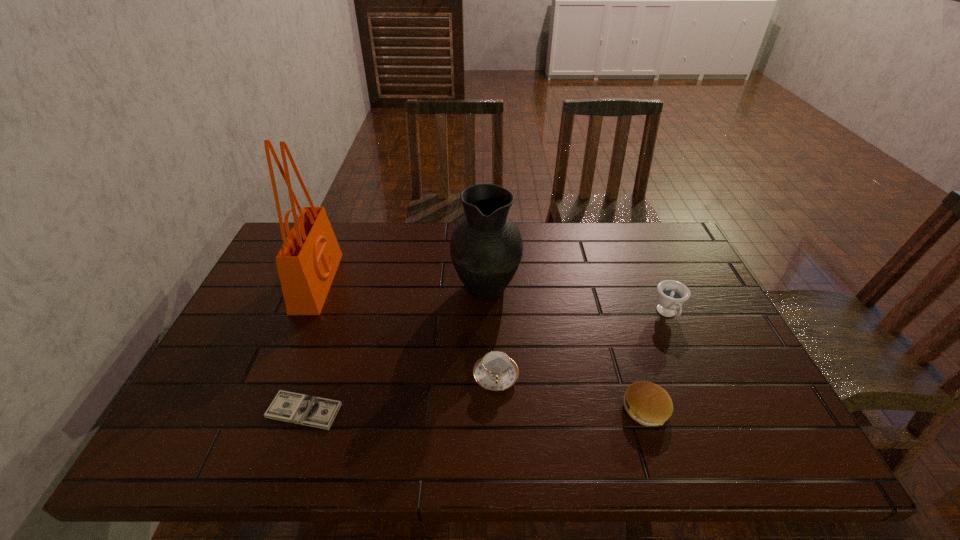
Image resolution: width=960 pixels, height=540 pixels. What are the coordinates of `vacant space that satisfies the following two spatial constraints: 1. on the back side of the patty; 2. on the left side of the dollar` in the screenshot? It's located at (304, 409).

In order to click on free space that satisfies the following two spatial constraints: 1. on the logo side of the tote bag; 2. on the left side of the patty in this screenshot , I will do `click(265, 409)`.

Find the location of `vacant region that satisfies the following two spatial constraints: 1. on the logo side of the tote bag; 2. on the right side of the patty`. vacant region that satisfies the following two spatial constraints: 1. on the logo side of the tote bag; 2. on the right side of the patty is located at coordinates (265, 409).